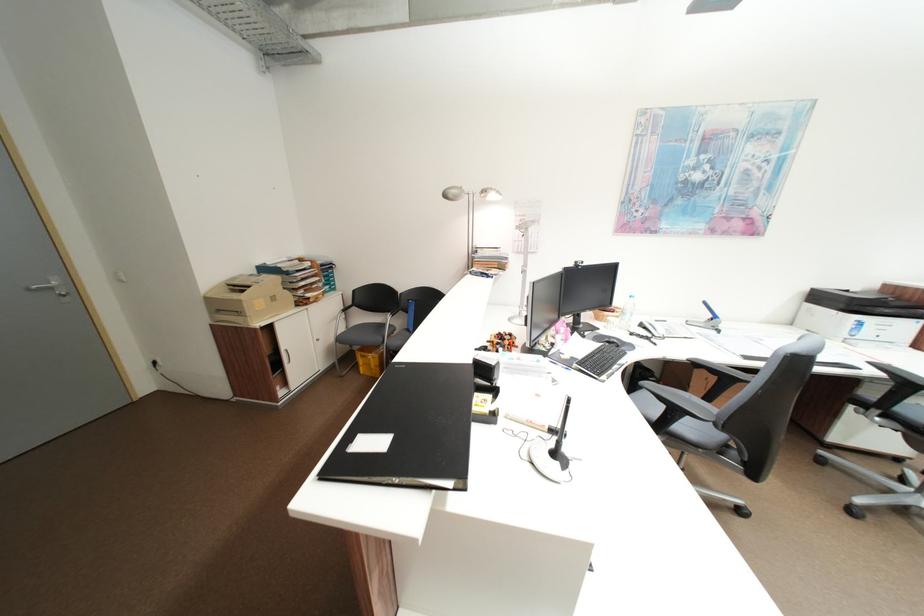
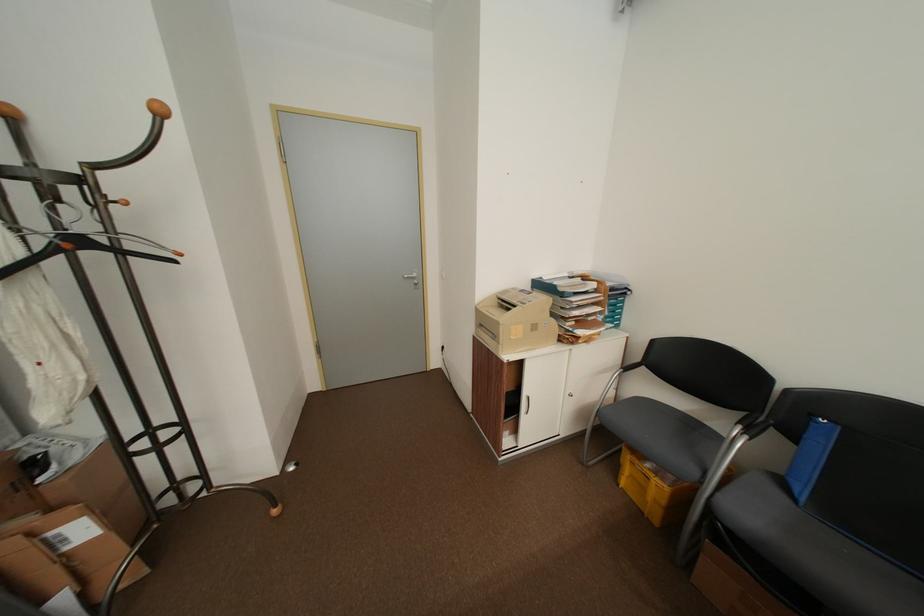
In the second image, find the point that corresponds to (298,368) in the first image.

(535, 419)